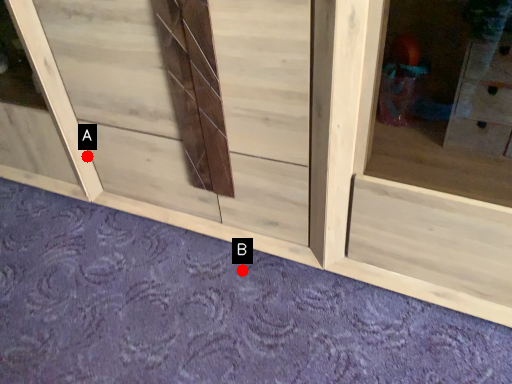
Question: Two points are circled on the image, labeled by A and B beside each circle. Which point appears farthest from the camera in this image?

Choices:
 (A) A is further
 (B) B is further

Answer: (A)